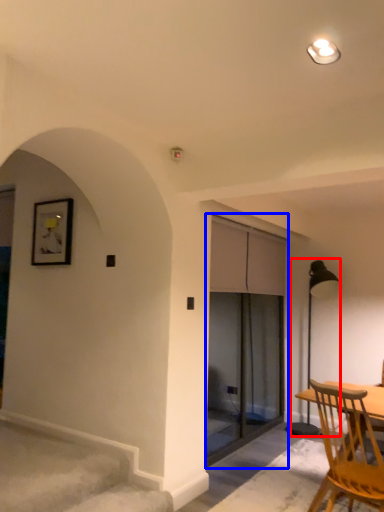
Question: Which object is further to the camera taking this photo, lamp (highlighted by a red box) or screen door (highlighted by a blue box)?

Choices:
 (A) lamp
 (B) screen door

Answer: (A)